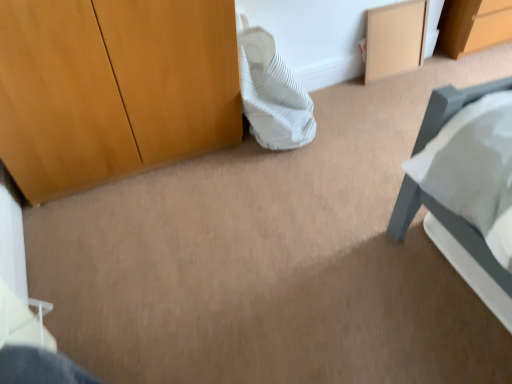
Question: Is beige matte cabinet at upper right bigger or smaller than white striped pillow at center?

Choices:
 (A) small
 (B) big

Answer: (A)

Question: Relative to white striped pillow at center, is beige matte cabinet at upper right in front or behind?

Choices:
 (A) front
 (B) behind

Answer: (B)

Question: Considering the positions of beige matte cabinet at upper right and white striped pillow at center in the image, is beige matte cabinet at upper right wider or thinner than white striped pillow at center?

Choices:
 (A) wide
 (B) thin

Answer: (B)

Question: From a real-world perspective, relative to beige matte cabinet at upper right, is white striped pillow at center vertically above or below?

Choices:
 (A) above
 (B) below

Answer: (A)

Question: Would you say white striped pillow at center is to the left or to the right of beige matte cabinet at upper right in the picture?

Choices:
 (A) right
 (B) left

Answer: (B)

Question: Looking at the image, does white striped pillow at center seem bigger or smaller compared to beige matte cabinet at upper right?

Choices:
 (A) small
 (B) big

Answer: (B)

Question: Is point (257, 64) closer or farther from the camera than point (420, 11)?

Choices:
 (A) closer
 (B) farther

Answer: (A)